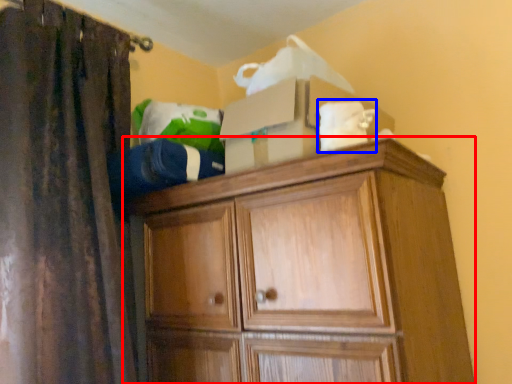
Question: Among these objects, which one is farthest to the camera, cupboard (highlighted by a red box) or clothing (highlighted by a blue box)?

Choices:
 (A) cupboard
 (B) clothing

Answer: (B)